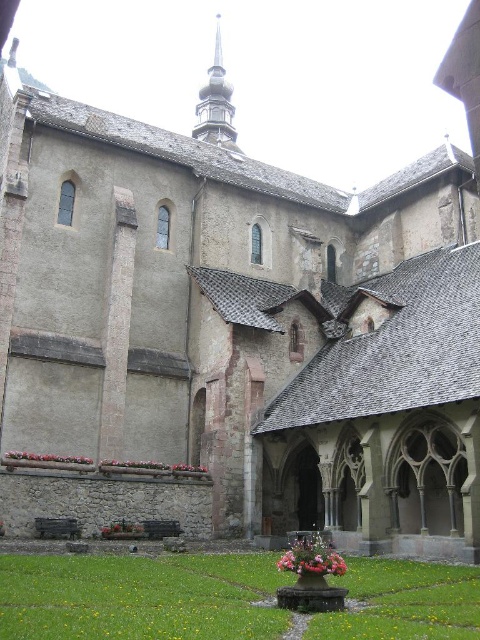
Is pink floral bouquet at center wider than pink fabric flower at lower center?

Incorrect, pink floral bouquet at center's width does not surpass pink fabric flower at lower center's.

Does point (327, 572) come in front of point (6, 452)?

Yes, point (327, 572) is closer to viewer.

Which is in front, point (285, 570) or point (21, 458)?

Point (285, 570) is more forward.

Find the location of a particular element. pink floral bouquet at center is located at coordinates coord(312,556).

At what (x,y) coordinates should I click in order to perform the action: click on smooth gold spire at upper center. Please return your answer as a coordinate pair (x, y). This screenshot has height=640, width=480. Looking at the image, I should click on (216, 104).

Is smooth gold spire at upper center positioned in front of pink fabric flower at lower center?

No, smooth gold spire at upper center is further to the viewer.

Which is behind, point (214, 140) or point (88, 461)?

The point (214, 140) is behind.

The image size is (480, 640). I want to click on smooth gold spire at upper center, so click(216, 104).

Who is taller, smooth gold spire at upper center or pink floral bouquet at center?

smooth gold spire at upper center

At what (x,y) coordinates should I click in order to perform the action: click on smooth gold spire at upper center. Please return your answer as a coordinate pair (x, y). This screenshot has width=480, height=640. Looking at the image, I should click on [x=216, y=104].

Locate an element on the screen. Image resolution: width=480 pixels, height=640 pixels. smooth gold spire at upper center is located at coordinates (216, 104).